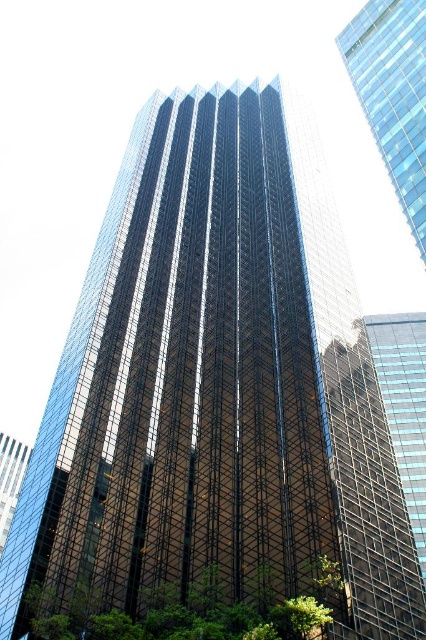
You are standing in front of the skyscraper and want to take a photo that includes both the green leafy tree at lower left and the green leafy tree at lower right. Which tree should you position closer to the left side of your camera frame?

You should position the green leafy tree at lower left closer to the left side of your camera frame since it is already to the left of the green leafy tree at lower right.

You are standing in the middle of a park and see the transparent glass skyscraper at upper right and the green leafy tree at lower left. Which object appears bigger to you?

The transparent glass skyscraper at upper right appears larger than the green leafy tree at lower left because it is larger in size.

You are standing in a park and looking at the transparent glass skyscraper at upper right and the green leafy tree at lower right. Which object is higher up in the image?

The transparent glass skyscraper at upper right is located above the green leafy tree at lower right, so it is higher up in the image.